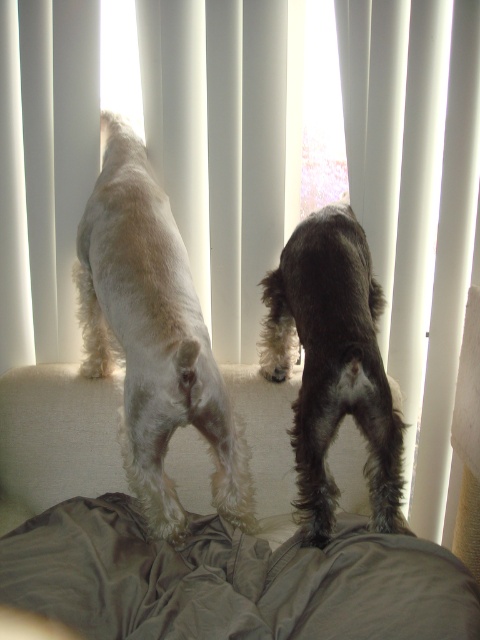
Question: Which object is the closest to the white fabric curtain at right?

Choices:
 (A) shiny brown fur at center
 (B) white fluffy dog at center

Answer: (A)

Question: Is white fabric curtain at right smaller than shiny brown fur at center?

Choices:
 (A) no
 (B) yes

Answer: (A)

Question: Estimate the real-world distances between objects in this image. Which object is farther from the white fabric curtain at right?

Choices:
 (A) shiny brown fur at center
 (B) white fluffy dog at center

Answer: (B)

Question: Can you confirm if white fluffy dog at center is positioned to the left of shiny brown fur at center?

Choices:
 (A) no
 (B) yes

Answer: (B)

Question: Which point is farther from the camera taking this photo?

Choices:
 (A) (132, 374)
 (B) (462, 236)
 (C) (303, 317)

Answer: (B)

Question: Can you confirm if white fabric curtain at right is thinner than shiny brown fur at center?

Choices:
 (A) yes
 (B) no

Answer: (B)